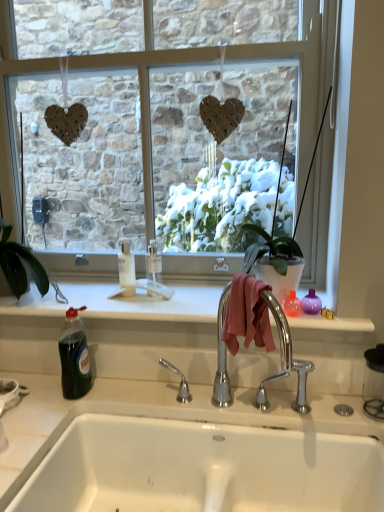
Question: Is green translucent bottle at lower left wider than green glossy houseplant at left?

Choices:
 (A) no
 (B) yes

Answer: (A)

Question: From a real-world perspective, is green translucent bottle at lower left below green glossy houseplant at left?

Choices:
 (A) no
 (B) yes

Answer: (B)

Question: Does green translucent bottle at lower left lie behind green glossy houseplant at left?

Choices:
 (A) no
 (B) yes

Answer: (A)

Question: Can you confirm if green translucent bottle at lower left is thinner than green glossy houseplant at left?

Choices:
 (A) yes
 (B) no

Answer: (A)

Question: Is green translucent bottle at lower left shorter than green glossy houseplant at left?

Choices:
 (A) yes
 (B) no

Answer: (B)

Question: From the image's perspective, is white glossy sink at lower center located above or below green translucent bottle at lower left?

Choices:
 (A) above
 (B) below

Answer: (B)

Question: Relative to green translucent bottle at lower left, is white glossy sink at lower center in front or behind?

Choices:
 (A) behind
 (B) front

Answer: (B)

Question: Considering the relative positions of white glossy sink at lower center and green translucent bottle at lower left in the image provided, is white glossy sink at lower center to the left or to the right of green translucent bottle at lower left?

Choices:
 (A) left
 (B) right

Answer: (B)

Question: Considering the positions of white glossy sink at lower center and green translucent bottle at lower left in the image, is white glossy sink at lower center taller or shorter than green translucent bottle at lower left?

Choices:
 (A) short
 (B) tall

Answer: (A)

Question: Looking at the image, does clear glass window at center seem bigger or smaller compared to white glossy sink at lower center?

Choices:
 (A) big
 (B) small

Answer: (A)

Question: In the image, is clear glass window at center positioned in front of or behind white glossy sink at lower center?

Choices:
 (A) behind
 (B) front

Answer: (A)

Question: Looking at their shapes, would you say clear glass window at center is wider or thinner than white glossy sink at lower center?

Choices:
 (A) wide
 (B) thin

Answer: (B)

Question: In terms of height, does clear glass window at center look taller or shorter compared to white glossy sink at lower center?

Choices:
 (A) tall
 (B) short

Answer: (A)

Question: In terms of height, does clear glass window at center look taller or shorter compared to green glossy houseplant at left?

Choices:
 (A) tall
 (B) short

Answer: (A)

Question: Based on their positions, is clear glass window at center located to the left or right of green glossy houseplant at left?

Choices:
 (A) left
 (B) right

Answer: (B)